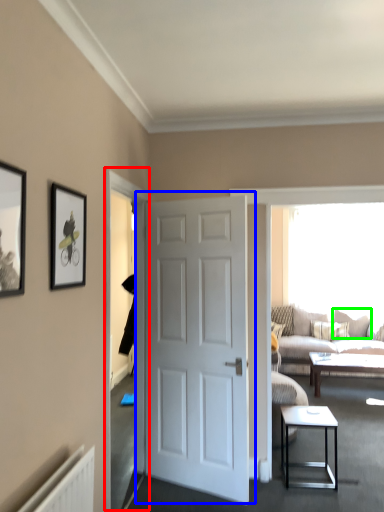
Question: Considering the real-world distances, which object is farthest from glass door (highlighted by a red box)? door (highlighted by a blue box) or pillow (highlighted by a green box)?

Choices:
 (A) door
 (B) pillow

Answer: (B)